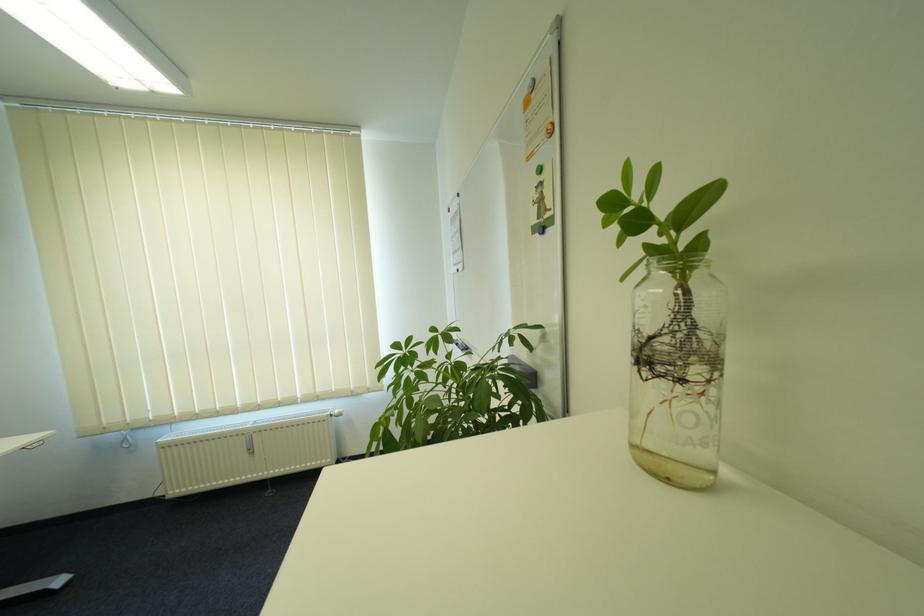
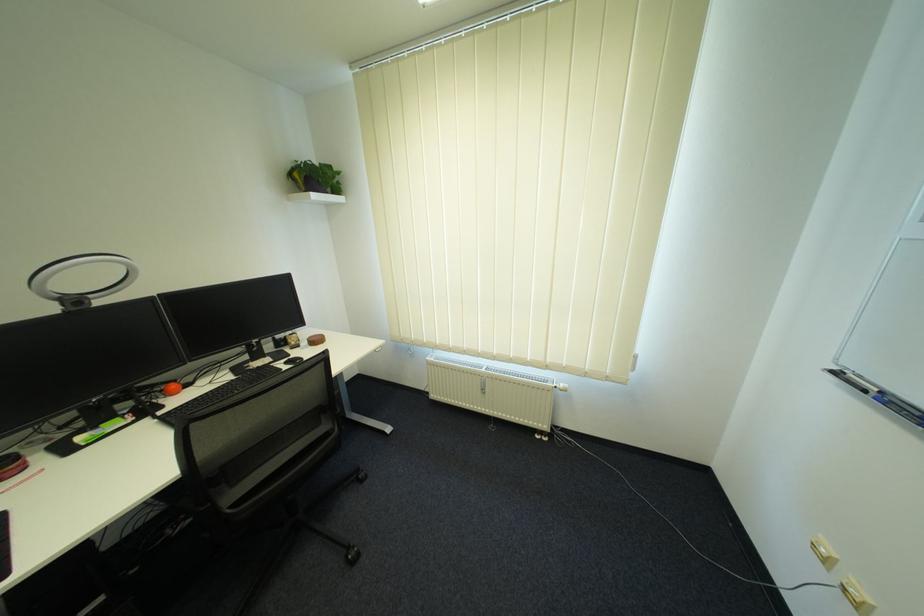
The first image is from the beginning of the video and the second image is from the end. How did the camera likely rotate when shooting the video?

The camera rotated toward left-down.